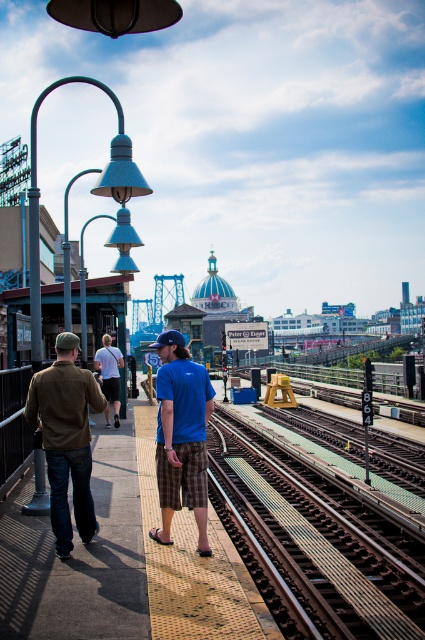
Question: Which is farther from the matte brown jacket at left?

Choices:
 (A) blue cotton t-shirt at center
 (B) white cotton shirt at center
 (C) brown metal train track at center

Answer: (B)

Question: Which of the following is the closest to the observer?

Choices:
 (A) (102, 376)
 (B) (99, 410)

Answer: (B)

Question: Observing the image, what is the correct spatial positioning of blue cotton t-shirt at center in reference to white cotton shirt at center?

Choices:
 (A) below
 (B) above

Answer: (B)

Question: Does brown metal train track at center have a smaller size compared to blue cotton t-shirt at center?

Choices:
 (A) yes
 (B) no

Answer: (B)

Question: Is brown metal train track at center further to camera compared to matte brown jacket at left?

Choices:
 (A) yes
 (B) no

Answer: (B)

Question: Which object appears closest to the camera in this image?

Choices:
 (A) white cotton shirt at center
 (B) blue cotton t-shirt at center
 (C) brown metal train track at center
 (D) matte brown jacket at left

Answer: (C)